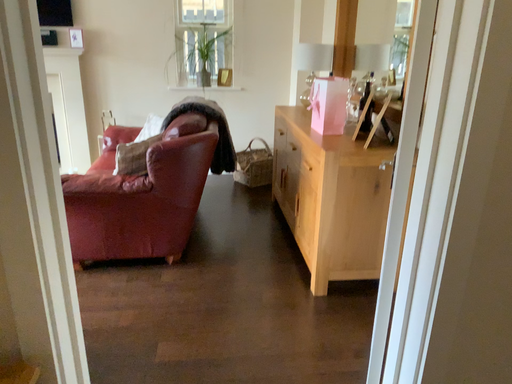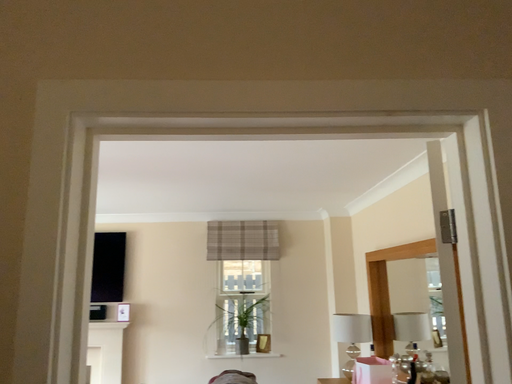
Question: How did the camera likely rotate when shooting the video?

Choices:
 (A) rotated upward
 (B) rotated downward

Answer: (A)